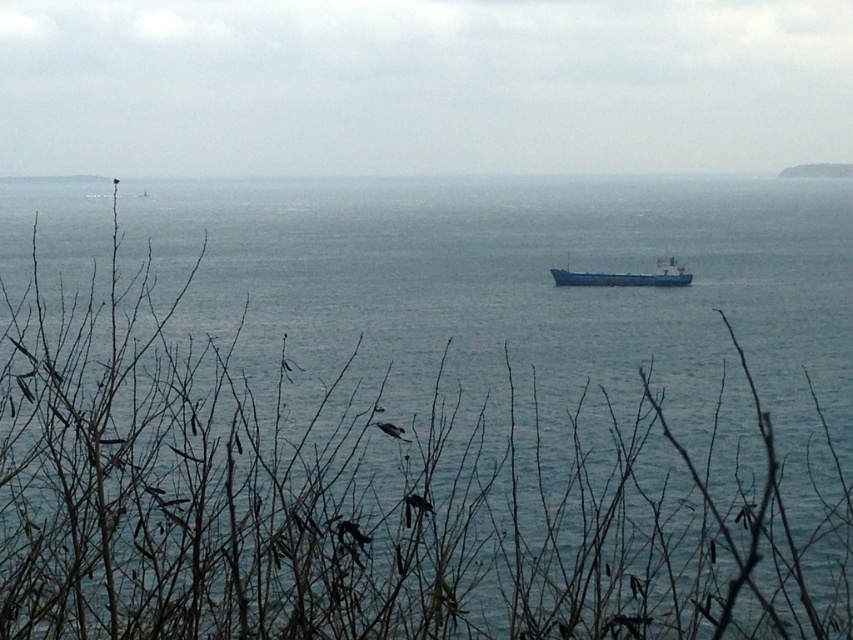
You are standing at the cliff overlooking the sea and see two points marked on the image. The first point is at coordinates point (651, 298) and the second is at point (585, 280). Which point is closer to you?

Point (651, 298) is closer to the viewer than point (585, 280).

You are standing at the cliff edge and see the blue matte water at center. If you were to throw a pebble into the water, would it land closer to the center or the edge?

The blue matte water at center is located at point (424, 420), so the pebble would land closer to the center.